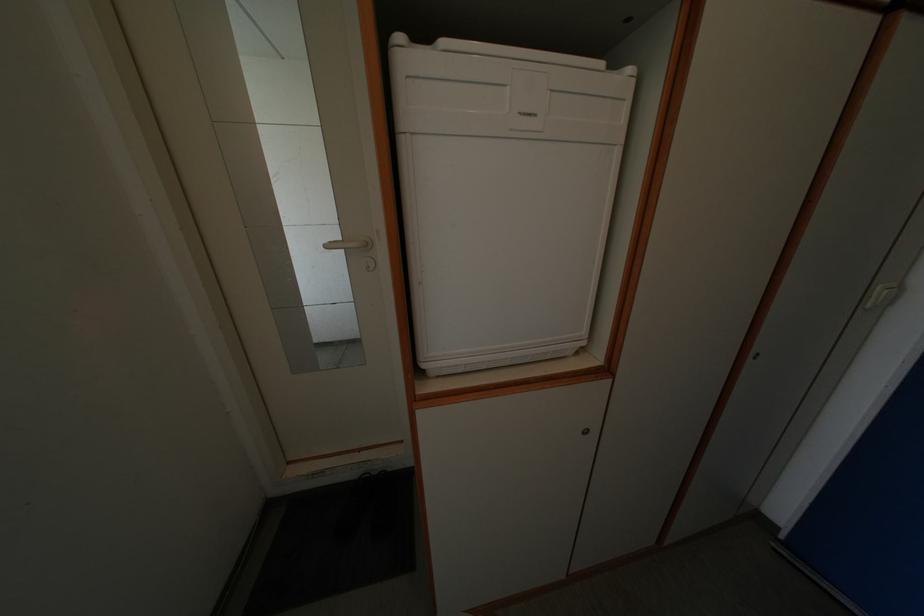
The image size is (924, 616). What do you see at coordinates (348, 244) in the screenshot?
I see `the white door handle` at bounding box center [348, 244].